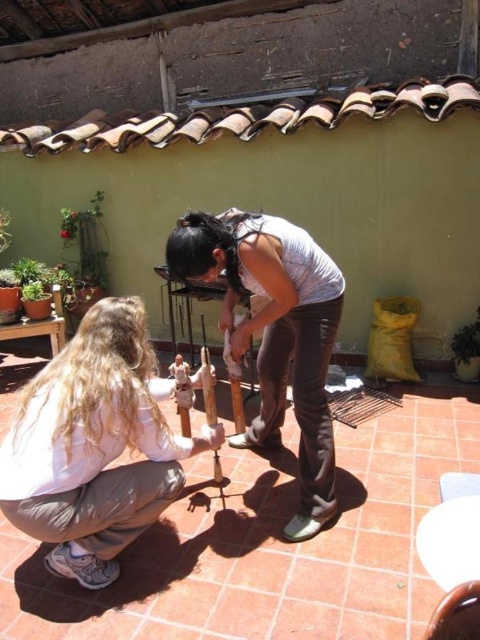
In the scene shown: You are standing in the courtyard and see the light brown hair at lower left and the matte white shirt at center. Which person is closer to the left side of the courtyard?

→ The light brown hair at lower left is closer to the left side of the courtyard because it is positioned to the left of the matte white shirt at center.

You are a photographer trying to capture a closeup of the light brown hair at lower left and the matte white shirt at center. Which object should you zoom in on to ensure both fit in the frame without cropping?

The matte white shirt at center has a smaller width compared to the light brown hair at lower left. To ensure both fit in the frame without cropping, you should zoom in on the matte white shirt at center first since it is narrower.